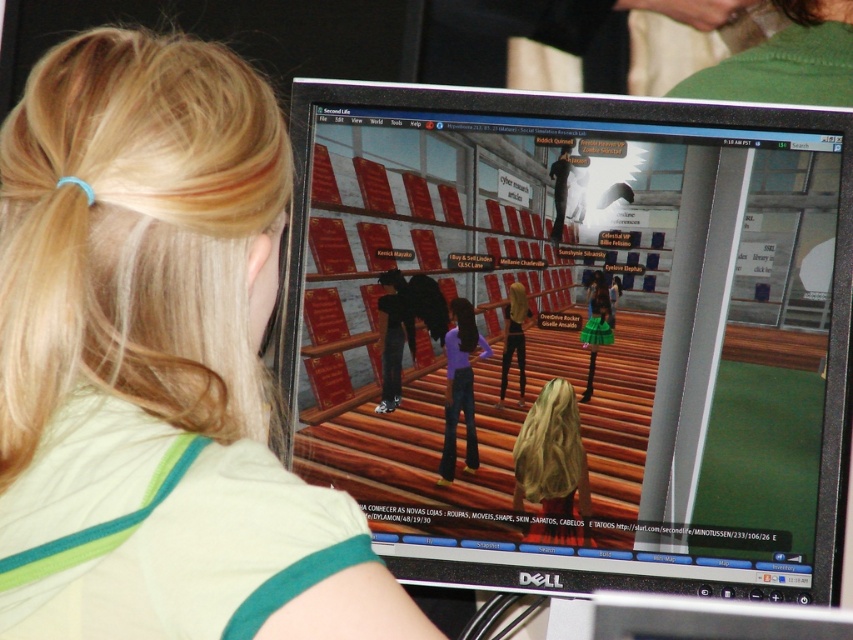
You are navigating a virtual world and need to move from the point at coordinates point (x=41, y=369) to the point at coordinates point (x=453, y=336). Which direction should you move to reach your destination?

To move from point (x=41, y=369) to point (x=453, y=336), you should move backward since point (x=41, y=369) is in front of point (x=453, y=336).

You are a virtual assistant in Second Life. You need to determine if the blonde hair at upper left is within the recommended 20 inches viewing distance for optimal screen visibility. Is it within the safe range?

The blonde hair at upper left is 23.11 inches away from the viewer, which exceeds the recommended 20 inches viewing distance for optimal screen visibility. It is outside the safe range.

You are an avatar in the virtual environment shown. You need to move from your current position to the wooden floor at center. Which direction should you move relative to the purple denim jeans at center?

You should move to the right of the purple denim jeans at center to reach the wooden floor at center.